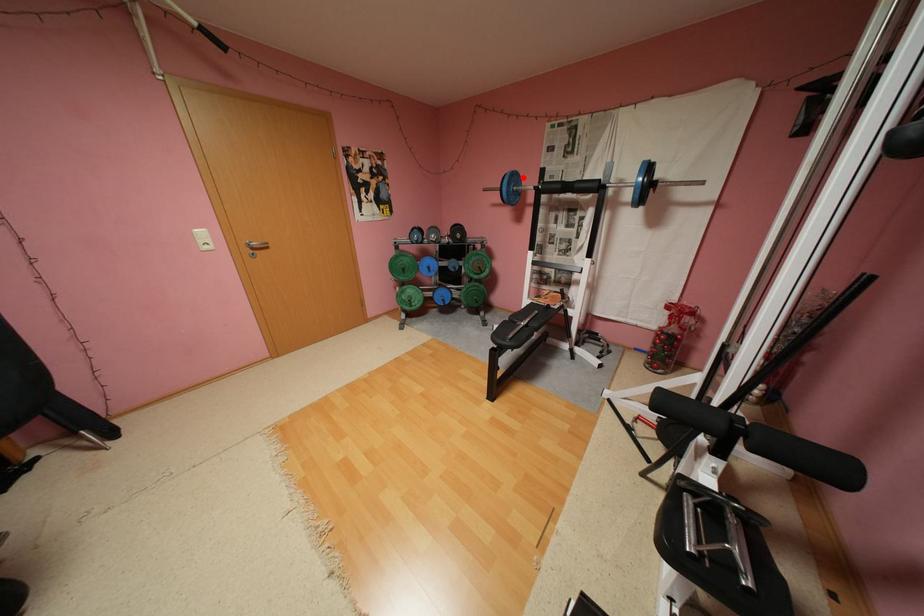
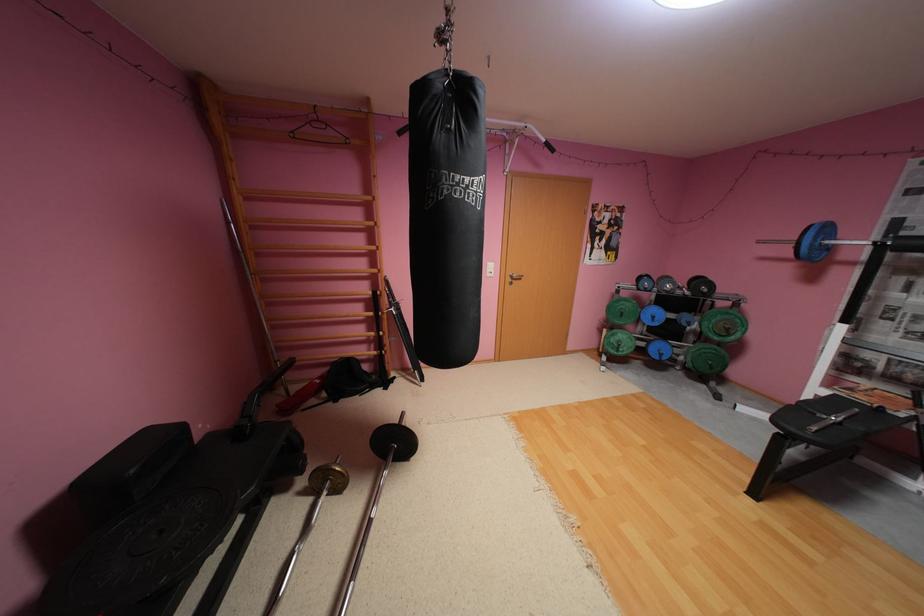
Question: I am providing you with two images of the same scene from different viewpoints. A red point is shown in image1. For the corresponding object point in image2, is it positioned nearer or farther from the camera?

Choices:
 (A) Nearer
 (B) Farther

Answer: (B)